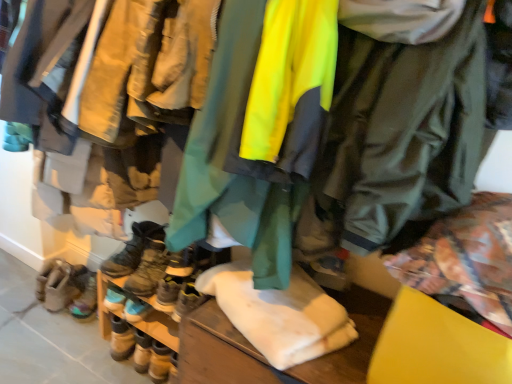
Question: Is leather boots at lower left, placed as the 1th footwear when sorted from left to right, surrounded by multicolored suede boots at lower left, which ranks as the fourth footwear in right-to-left order?

Choices:
 (A) no
 (B) yes

Answer: (A)

Question: Can you confirm if multicolored suede boots at lower left, which is counted as the second footwear, starting from the left, is positioned to the right of leather boots at lower left, placed as the 1th footwear when sorted from left to right?

Choices:
 (A) no
 (B) yes

Answer: (B)

Question: Is multicolored suede boots at lower left, which is counted as the second footwear, starting from the left, closer to the viewer compared to leather boots at lower left, the 5th footwear when ordered from right to left?

Choices:
 (A) no
 (B) yes

Answer: (B)

Question: Can you confirm if multicolored suede boots at lower left, which ranks as the fourth footwear in right-to-left order, is smaller than leather boots at lower left, placed as the 1th footwear when sorted from left to right?

Choices:
 (A) yes
 (B) no

Answer: (A)

Question: Does multicolored suede boots at lower left, which is counted as the second footwear, starting from the left, have a lesser height compared to leather boots at lower left, placed as the 1th footwear when sorted from left to right?

Choices:
 (A) no
 (B) yes

Answer: (A)

Question: Considering the positions of leather boots at lower left, the 4th footwear positioned from the left, and green matte jacket at center, the 1th jacket in the right-to-left sequence, in the image, is leather boots at lower left, the 4th footwear positioned from the left, wider or thinner than green matte jacket at center, the 1th jacket in the right-to-left sequence,?

Choices:
 (A) thin
 (B) wide

Answer: (A)

Question: Is point (x=133, y=336) closer or farther from the camera than point (x=350, y=29)?

Choices:
 (A) closer
 (B) farther

Answer: (B)

Question: Would you say leather boots at lower left, acting as the 2th footwear starting from the right, is inside or outside green matte jacket at center, the 2th jacket viewed from the left?

Choices:
 (A) outside
 (B) inside

Answer: (A)

Question: Considering the positions of leather boots at lower left, acting as the 2th footwear starting from the right, and green matte jacket at center, the 2th jacket viewed from the left, in the image, is leather boots at lower left, acting as the 2th footwear starting from the right, bigger or smaller than green matte jacket at center, the 2th jacket viewed from the left,?

Choices:
 (A) small
 (B) big

Answer: (A)

Question: From the image's perspective, is leather boots at lower left, acting as the 2th footwear starting from the right, positioned above or below multicolored suede boots at lower left, which ranks as the fourth footwear in right-to-left order?

Choices:
 (A) below
 (B) above

Answer: (A)

Question: From a real-world perspective, relative to multicolored suede boots at lower left, which is counted as the second footwear, starting from the left, is leather boots at lower left, the 4th footwear positioned from the left, vertically above or below?

Choices:
 (A) above
 (B) below

Answer: (B)

Question: Is leather boots at lower left, the 4th footwear positioned from the left, wider or thinner than multicolored suede boots at lower left, which ranks as the fourth footwear in right-to-left order?

Choices:
 (A) thin
 (B) wide

Answer: (A)

Question: Is leather boots at lower left, the 4th footwear positioned from the left, spatially inside multicolored suede boots at lower left, which is counted as the second footwear, starting from the left, or outside of it?

Choices:
 (A) outside
 (B) inside

Answer: (A)

Question: In the image, is neon green waterproof jacket at center, placed as the 2th jacket when sorted from right to left, positioned in front of or behind leather boots at center, the 1th footwear in the right-to-left sequence?

Choices:
 (A) front
 (B) behind

Answer: (A)

Question: Would you say neon green waterproof jacket at center, placed as the 2th jacket when sorted from right to left, is inside or outside leather boots at center, the 1th footwear in the right-to-left sequence?

Choices:
 (A) inside
 (B) outside

Answer: (B)